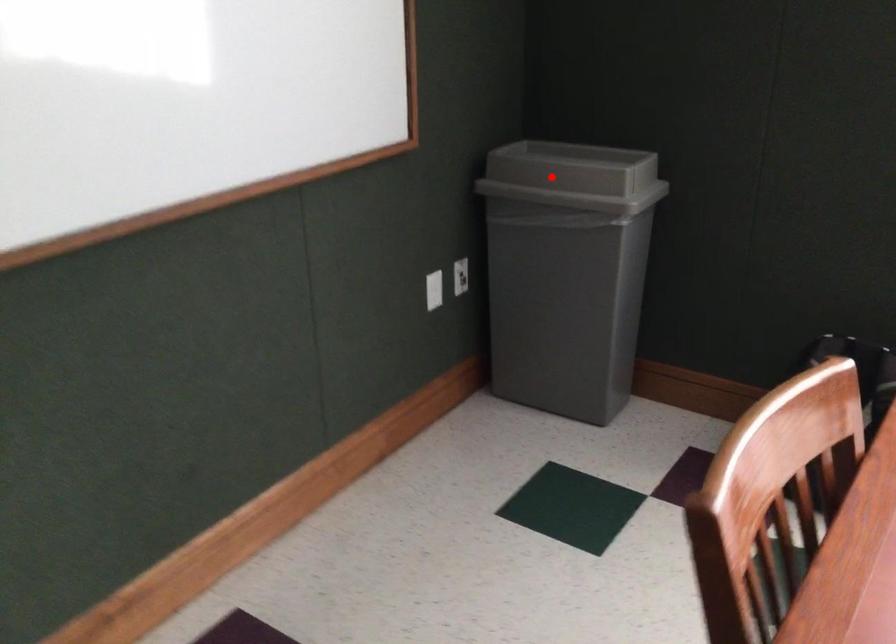
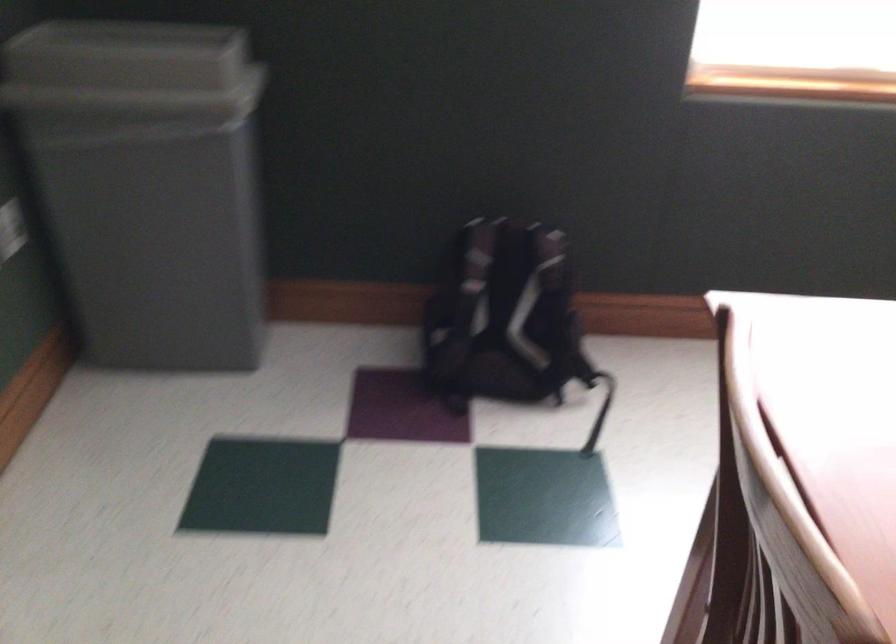
In the second image, find the point that corresponds to the highlighted location in the first image.

(131, 71)